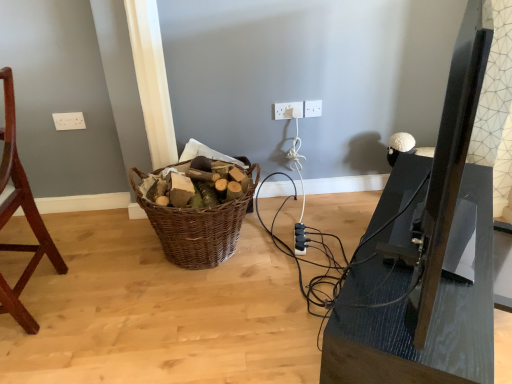
Question: Is black plastic extension cord at lower center in contact with woven brown basket at center?

Choices:
 (A) yes
 (B) no

Answer: (B)

Question: Are black plastic extension cord at lower center and woven brown basket at center far apart?

Choices:
 (A) yes
 (B) no

Answer: (B)

Question: Can you confirm if black plastic extension cord at lower center is positioned to the left of woven brown basket at center?

Choices:
 (A) yes
 (B) no

Answer: (B)

Question: Is black plastic extension cord at lower center shorter than woven brown basket at center?

Choices:
 (A) yes
 (B) no

Answer: (A)

Question: Is black plastic extension cord at lower center positioned behind woven brown basket at center?

Choices:
 (A) no
 (B) yes

Answer: (B)

Question: Is black plastic extension cord at lower center wider than woven brown basket at center?

Choices:
 (A) no
 (B) yes

Answer: (A)

Question: Does white plastic electric outlet at upper center, which is the third electric outlet in right-to-left order, have a smaller size compared to woven brown basket at center?

Choices:
 (A) no
 (B) yes

Answer: (B)

Question: Considering the relative sizes of white plastic electric outlet at upper center, which is the third electric outlet in right-to-left order, and woven brown basket at center in the image provided, is white plastic electric outlet at upper center, which is the third electric outlet in right-to-left order, bigger than woven brown basket at center?

Choices:
 (A) yes
 (B) no

Answer: (B)

Question: Is white plastic electric outlet at upper center, placed as the first electric outlet when sorted from left to right, facing towards woven brown basket at center?

Choices:
 (A) yes
 (B) no

Answer: (B)

Question: From the image's perspective, does white plastic electric outlet at upper center, which is the third electric outlet in right-to-left order, appear higher than woven brown basket at center?

Choices:
 (A) no
 (B) yes

Answer: (B)

Question: Is white plastic electric outlet at upper center, which is the third electric outlet in right-to-left order, closer to the viewer compared to woven brown basket at center?

Choices:
 (A) yes
 (B) no

Answer: (B)

Question: Is white plastic electric outlet at upper center, which is the third electric outlet in right-to-left order, completely or partially outside of woven brown basket at center?

Choices:
 (A) no
 (B) yes

Answer: (B)

Question: Is white plastic electric outlet at center, which is the 2th electric outlet from left to right, oriented away from matte black tv stand at right?

Choices:
 (A) yes
 (B) no

Answer: (B)